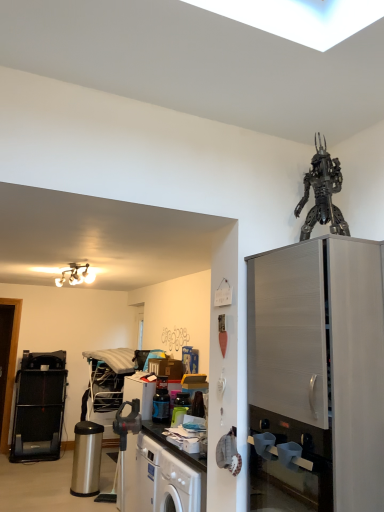
Question: From the image's perspective, is metallic robot at upper right on top of black plastic treadmill at left, arranged as the first appliance when viewed from the back?

Choices:
 (A) no
 (B) yes

Answer: (B)

Question: Is metallic robot at upper right not inside black plastic treadmill at left, arranged as the first appliance when viewed from the back?

Choices:
 (A) no
 (B) yes

Answer: (B)

Question: Is metallic robot at upper right surrounding black plastic treadmill at left, arranged as the first appliance when viewed from the back?

Choices:
 (A) yes
 (B) no

Answer: (B)

Question: Considering the relative positions of metallic robot at upper right and black plastic treadmill at left, arranged as the first appliance when viewed from the back, in the image provided, is metallic robot at upper right to the right of black plastic treadmill at left, arranged as the first appliance when viewed from the back, from the viewer's perspective?

Choices:
 (A) no
 (B) yes

Answer: (B)

Question: Can you confirm if metallic robot at upper right is taller than black plastic treadmill at left, arranged as the first appliance when viewed from the back?

Choices:
 (A) yes
 (B) no

Answer: (B)

Question: Considering the relative positions of black plastic treadmill at left, positioned as the 1th appliance in left-to-right order, and stainless steel trash can at lower left, which ranks as the 2th appliance in right-to-left order, in the image provided, is black plastic treadmill at left, positioned as the 1th appliance in left-to-right order, to the left or to the right of stainless steel trash can at lower left, which ranks as the 2th appliance in right-to-left order,?

Choices:
 (A) right
 (B) left

Answer: (B)

Question: From the image's perspective, is black plastic treadmill at left, arranged as the first appliance when viewed from the back, positioned above or below stainless steel trash can at lower left, the 2th appliance when ordered from front to back?

Choices:
 (A) above
 (B) below

Answer: (A)

Question: In terms of height, does black plastic treadmill at left, which ranks as the third appliance in right-to-left order, look taller or shorter compared to stainless steel trash can at lower left, the second appliance when ordered from back to front?

Choices:
 (A) short
 (B) tall

Answer: (B)

Question: Is point (41, 386) positioned closer to the camera than point (79, 435)?

Choices:
 (A) farther
 (B) closer

Answer: (B)

Question: Is satin silver cabinet at right bigger or smaller than stainless steel trash can at lower left, which ranks as the 2th appliance in right-to-left order?

Choices:
 (A) big
 (B) small

Answer: (A)

Question: Looking at their shapes, would you say satin silver cabinet at right is wider or thinner than stainless steel trash can at lower left, the 2th appliance in the left-to-right sequence?

Choices:
 (A) wide
 (B) thin

Answer: (A)

Question: From a real-world perspective, is satin silver cabinet at right positioned above or below stainless steel trash can at lower left, the 2th appliance when ordered from front to back?

Choices:
 (A) below
 (B) above

Answer: (B)

Question: Is point (319, 435) positioned closer to the camera than point (89, 441)?

Choices:
 (A) closer
 (B) farther

Answer: (A)

Question: Relative to metallic/reflective chandelier at upper left, is metallic robot at upper right in front or behind?

Choices:
 (A) front
 (B) behind

Answer: (A)

Question: From their relative heights in the image, would you say metallic robot at upper right is taller or shorter than metallic/reflective chandelier at upper left?

Choices:
 (A) tall
 (B) short

Answer: (A)